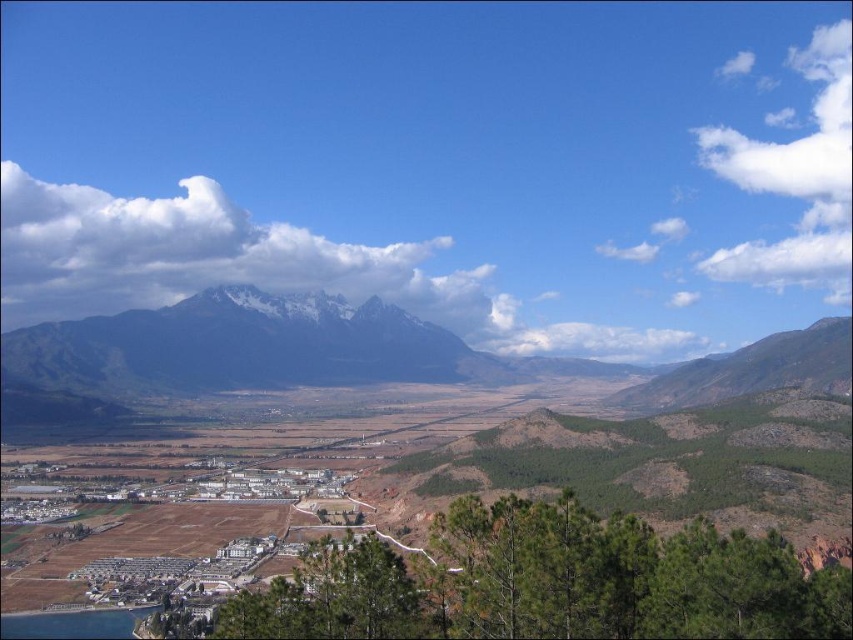
Does point (430, 320) come in front of point (74, 336)?

No, (430, 320) is further to viewer.

Is white fluffy cloud at upper left thinner than snowy granite mountain range at center?

No.

Does point (373, 282) come behind point (112, 330)?

Yes, point (373, 282) is farther from viewer.

Identify the location of white fluffy cloud at upper left. (254, 268).